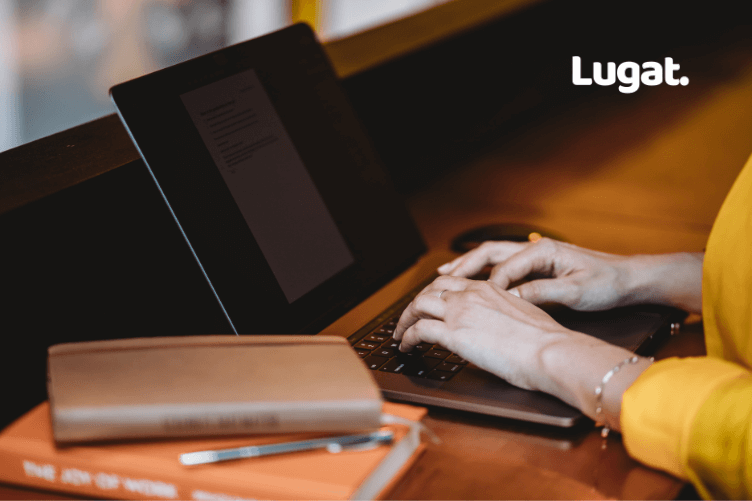
Point out all instances of where coffee mug could be placed in the image. Your answer should be formatted as a list of tuples, i.e. [(x1, y1), (x2, y2), ...], where each tuple contains the x and y coordinates of a point satisfying the conditions above.

[(622, 212)]